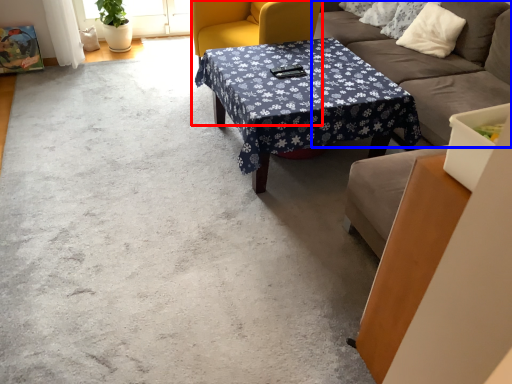
Question: Which point is closer to the camera, swivel chair (highlighted by a red box) or studio couch (highlighted by a blue box)?

Choices:
 (A) swivel chair
 (B) studio couch

Answer: (B)